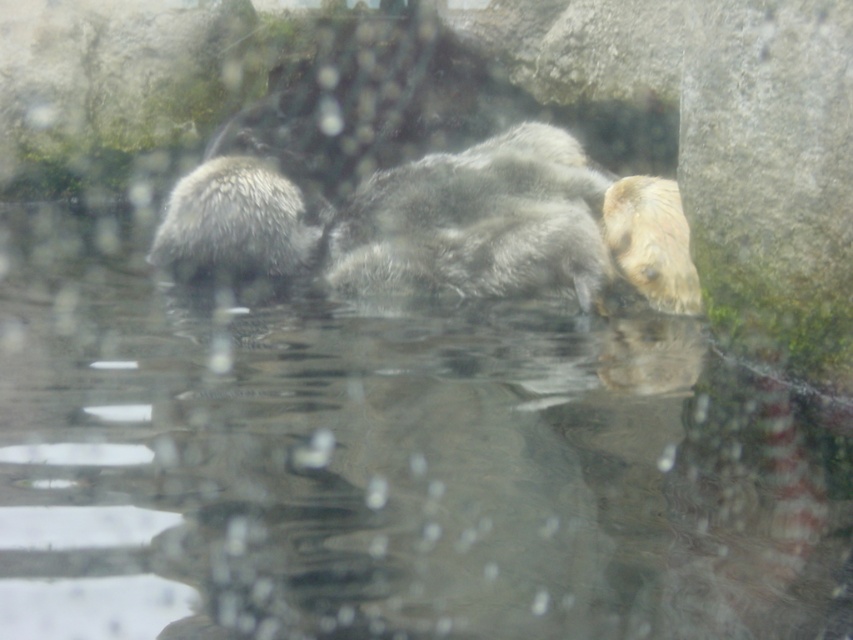
Question: Does clear water at center come in front of fuzzy white otter at left?

Choices:
 (A) yes
 (B) no

Answer: (A)

Question: Which of the following is the farthest from the observer?

Choices:
 (A) (178, 275)
 (B) (450, 506)

Answer: (A)

Question: Which of the following is the closest to the observer?

Choices:
 (A) (241, 248)
 (B) (544, 456)

Answer: (B)

Question: Can you confirm if clear water at center is positioned to the right of fuzzy white otter at left?

Choices:
 (A) no
 (B) yes

Answer: (B)

Question: Can you confirm if clear water at center is positioned above fuzzy white otter at left?

Choices:
 (A) no
 (B) yes

Answer: (A)